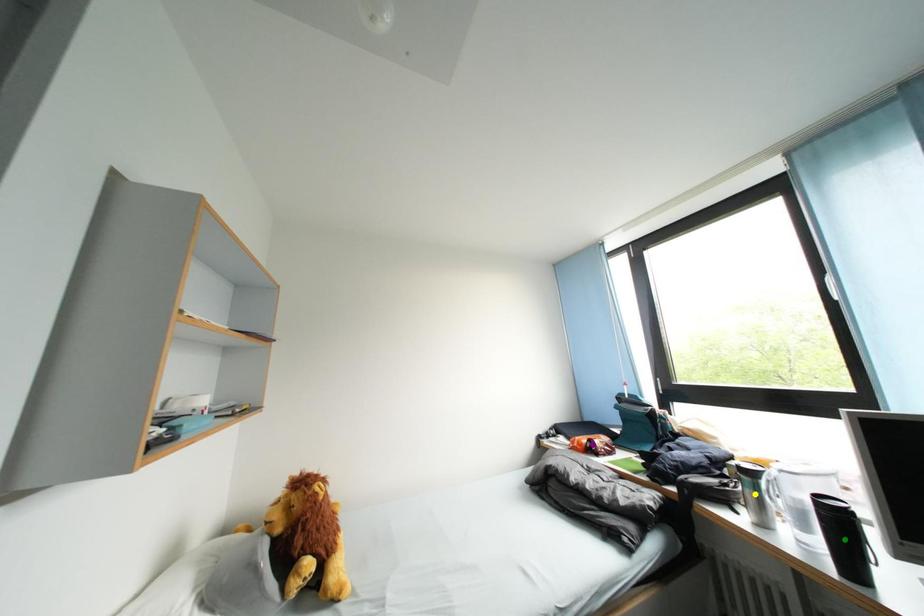
Order these from nearest to farthest:
- purple point
- green point
- yellow point

purple point
yellow point
green point